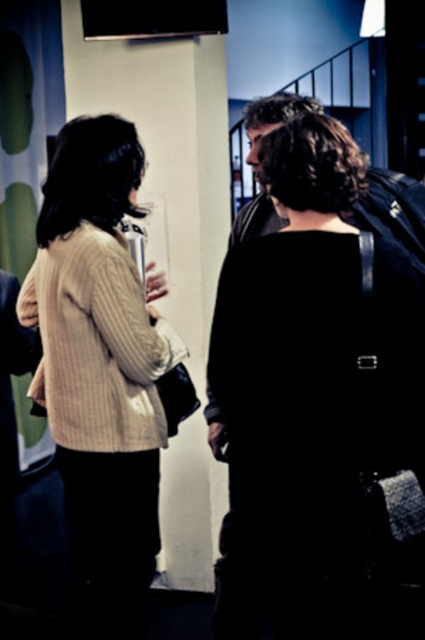
You are standing in the room and want to hand a document to the person wearing the beige ribbed sweater at center. Which direction should you move to approach them from the knitted beige sweater at left?

Answer: The beige ribbed sweater at center is to the right of the knitted beige sweater at left, so you should move to the right to approach the beige ribbed sweater at center from the knitted beige sweater at left.

You are organizing a clothing donation drive and need to categorize the beige ribbed sweater at center and the knitted beige sweater at left based on their sizes. Which sweater should be placed in the small section?

The beige ribbed sweater at center should be placed in the small section because it has a smaller size compared to the knitted beige sweater at left.